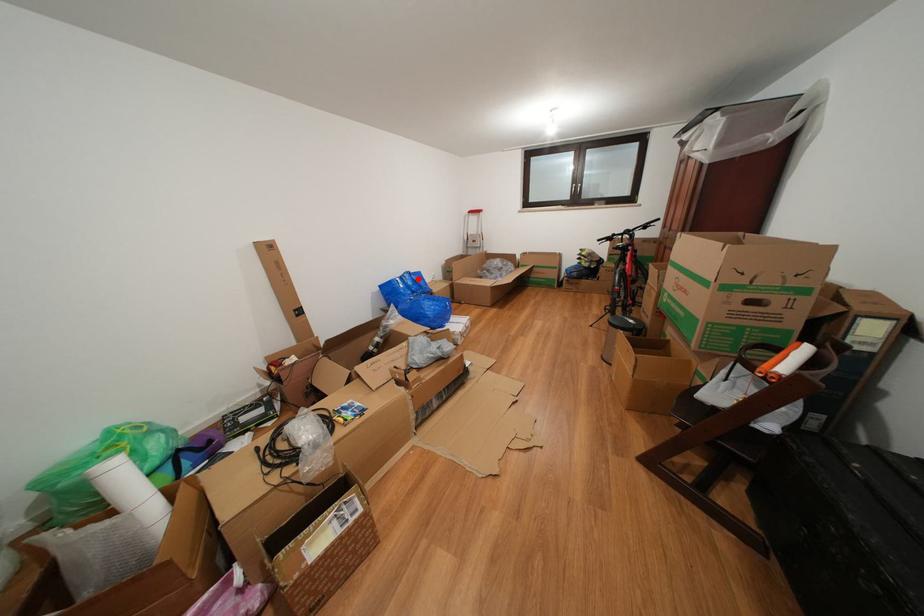
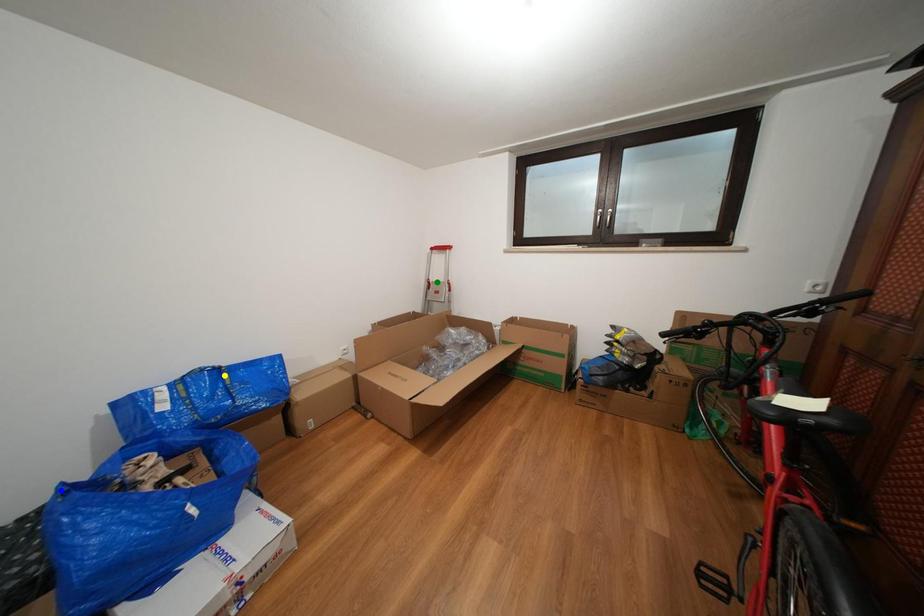
Question: I am providing you with two images of the same scene from different viewpoints. A red point is marked on the first image. You are given multiple points on the second image. Which point in image 2 represents the same 3d spot as the red point in image 1?

Choices:
 (A) green point
 (B) yellow point
 (C) blue point

Answer: (B)